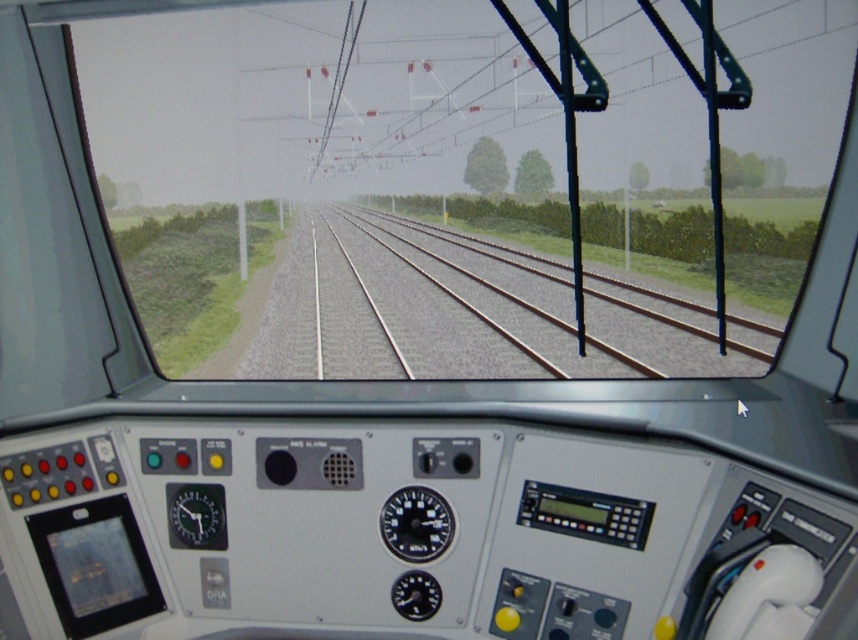
You are a train engineer who needs to monitor both the black plastic gauge at center and the metallic gauge at center left. Which gauge is located to the right of the other?

The black plastic gauge at center is positioned on the right side of metallic gauge at center left, so the black plastic gauge at center is to the right of the metallic gauge at center left.

You are a train operator checking the control panel. You notice two gauges on the panel. One is the black plastic gauge at center and the other is the metallic gauge at center left. Which gauge do you need to look up to more to see?

The black plastic gauge at center is much taller than the metallic gauge at center left, so you need to look up more to see the black plastic gauge at center.

You are a train engineer checking the control panel. You notice the brown metal track at center and the metallic gauge at center left. Which object appears larger in height?

The brown metal track at center is taller than the metallic gauge at center left.